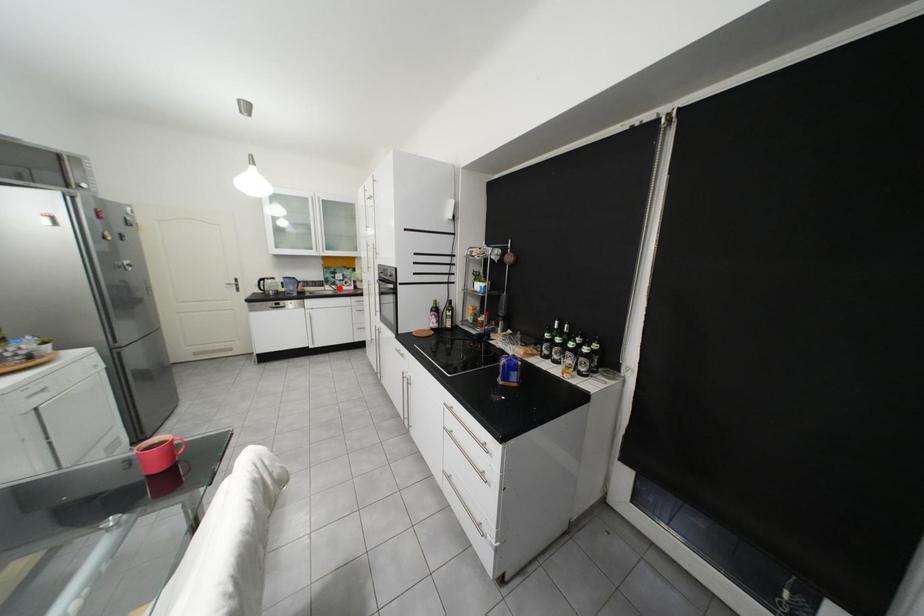
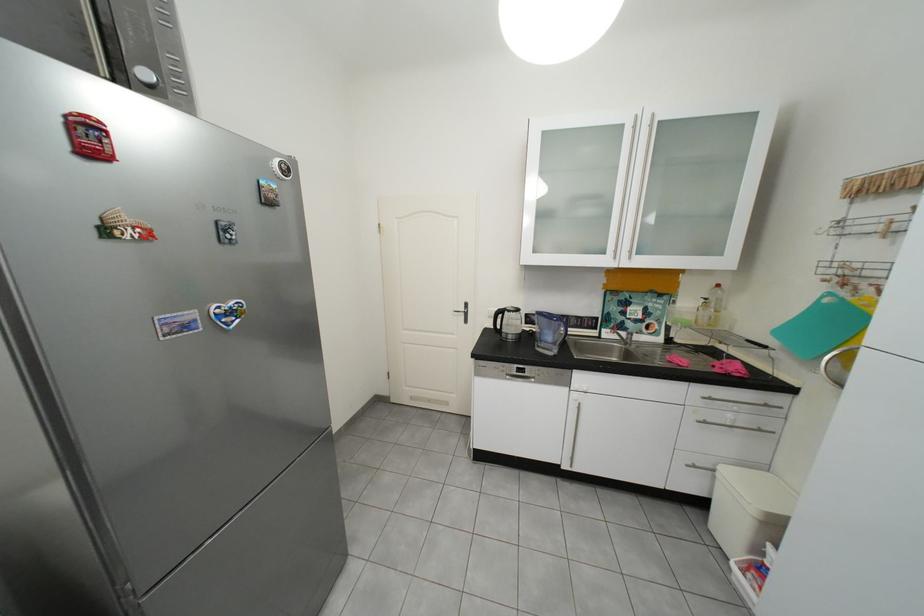
Where in the second image is the point corresponding to the highlighted location from the first image?

(619, 334)